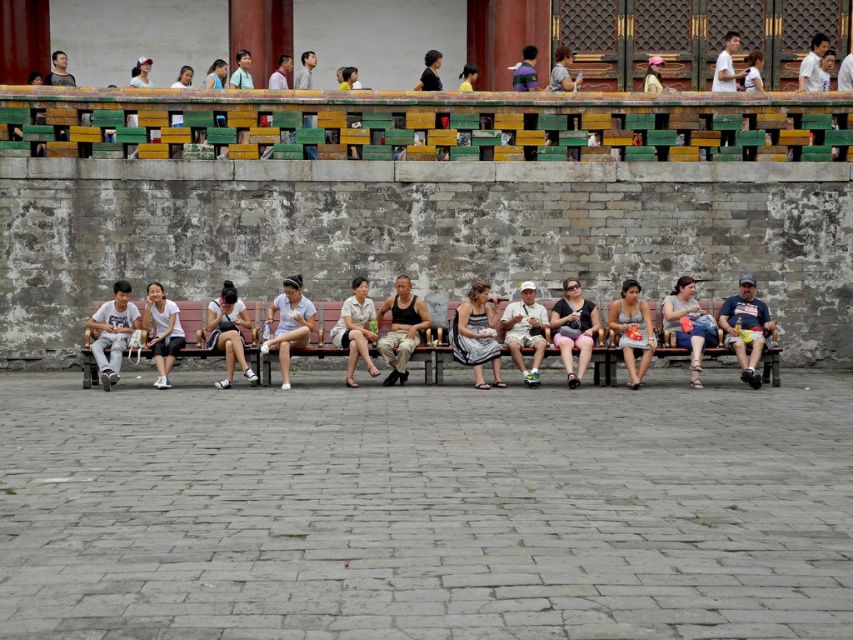
Identify the location of black matte tank top at center. The width and height of the screenshot is (853, 640). (401, 328).

Where is `black matte tank top at center`? This screenshot has height=640, width=853. black matte tank top at center is located at coordinates (401, 328).

Who is lower down, black matte tank top at center or silver metallic dress at center?

silver metallic dress at center is below.

Which is behind, point (381, 344) or point (619, 314)?

The point (619, 314) is behind.

You are a GUI agent. You are given a task and a screenshot of the screen. Output one action in this format:
    pyautogui.click(x=<x>, y=<y>)
    Task: Click on the black matte tank top at center
    This screenshot has width=853, height=640.
    Given the screenshot: What is the action you would take?
    pyautogui.click(x=401, y=328)

Identify the location of brown wooden bench at center. (434, 362).